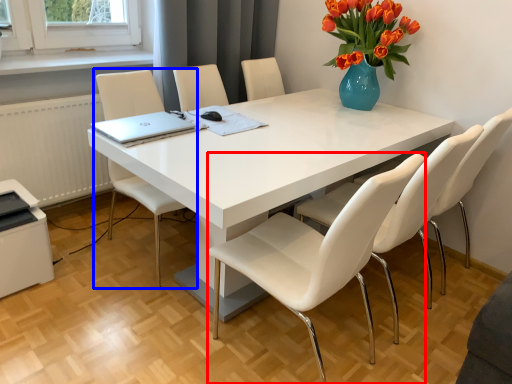
Question: Which of the following is the closest to the observer, chair (highlighted by a red box) or chair (highlighted by a blue box)?

Choices:
 (A) chair
 (B) chair

Answer: (A)